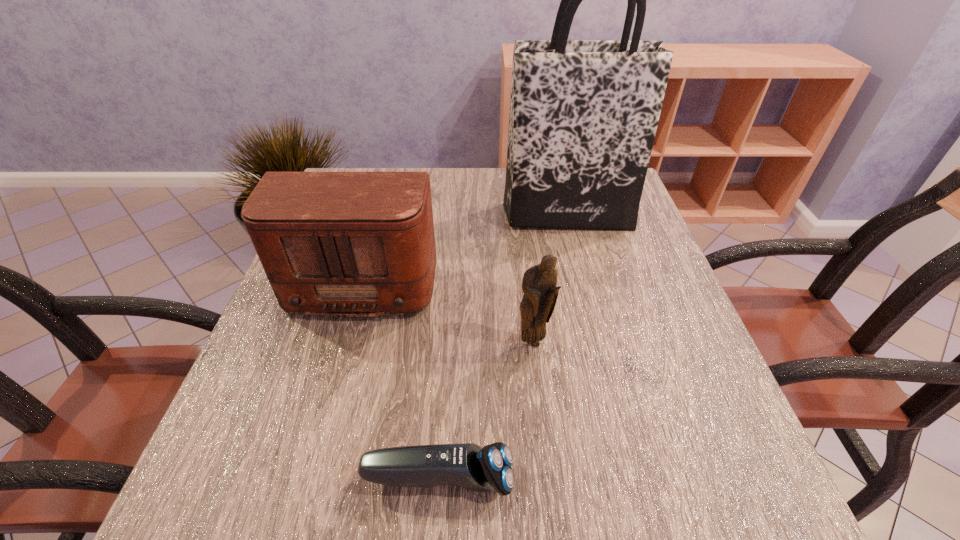
Select which object appears as the third closest to the figurine. Please provide its 2D coordinates. Your answer should be formatted as a tuple, i.e. [(x, y)], where the tuple contains the x and y coordinates of a point satisfying the conditions above.

[(583, 116)]

Locate an element on the screen. This screenshot has width=960, height=540. vacant space that satisfies the following two spatial constraints: 1. on the front of the farthest object with the design; 2. on the head of the nearest object is located at coordinates (632, 479).

This screenshot has height=540, width=960. What are the coordinates of `vacant space that satisfies the following two spatial constraints: 1. on the front of the farthest object with the design; 2. on the head of the nearest object` in the screenshot? It's located at (632, 479).

I want to click on free location that satisfies the following two spatial constraints: 1. on the front-facing side of the figurine; 2. on the head of the nearest object, so click(548, 479).